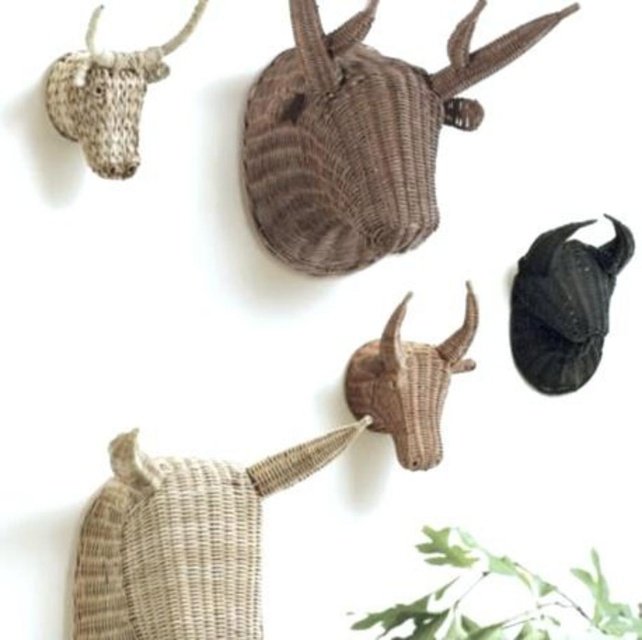
Question: Which point is farther to the camera?

Choices:
 (A) (593, 554)
 (B) (247, 488)
 (C) (569, 294)

Answer: (A)

Question: Among these objects, which one is nearest to the camera?

Choices:
 (A) black matte horn at upper center
 (B) white woven bull head at upper left
 (C) green leafy plant at upper center

Answer: (C)

Question: Is the position of green leafy plant at upper center less distant than that of rattan horned animal head at center?

Choices:
 (A) yes
 (B) no

Answer: (A)

Question: Is rattan textured bull head at upper center in front of woven beige basket at upper left?

Choices:
 (A) no
 (B) yes

Answer: (A)

Question: Is black matte horn at upper center to the left of white woven bull head at upper left from the viewer's perspective?

Choices:
 (A) no
 (B) yes

Answer: (A)

Question: Which object is positioned closest to the green leafy plant at upper center?

Choices:
 (A) woven beige basket at upper left
 (B) rattan horned animal head at center
 (C) black matte horn at upper center
 (D) rattan textured bull head at upper center

Answer: (B)